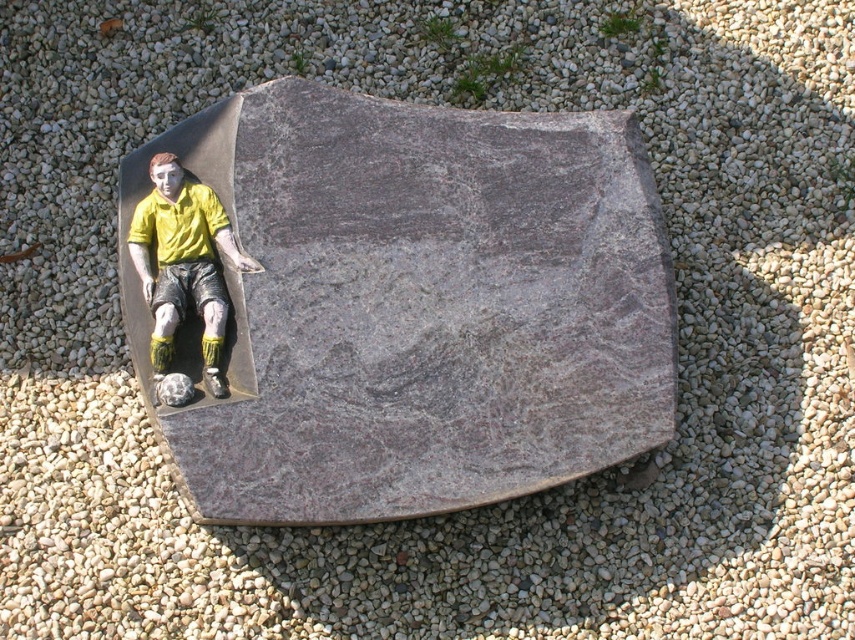
Question: Is granite stone at upper left below matte yellow shirt at center?

Choices:
 (A) no
 (B) yes

Answer: (B)

Question: Which point is closer to the camera?

Choices:
 (A) (333, 248)
 (B) (164, 365)

Answer: (B)

Question: Does granite stone at upper left have a greater width compared to matte yellow shirt at center?

Choices:
 (A) no
 (B) yes

Answer: (B)

Question: Which object appears farthest from the camera in this image?

Choices:
 (A) granite stone at upper left
 (B) matte yellow shirt at center

Answer: (B)

Question: Is granite stone at upper left thinner than matte yellow shirt at center?

Choices:
 (A) yes
 (B) no

Answer: (B)